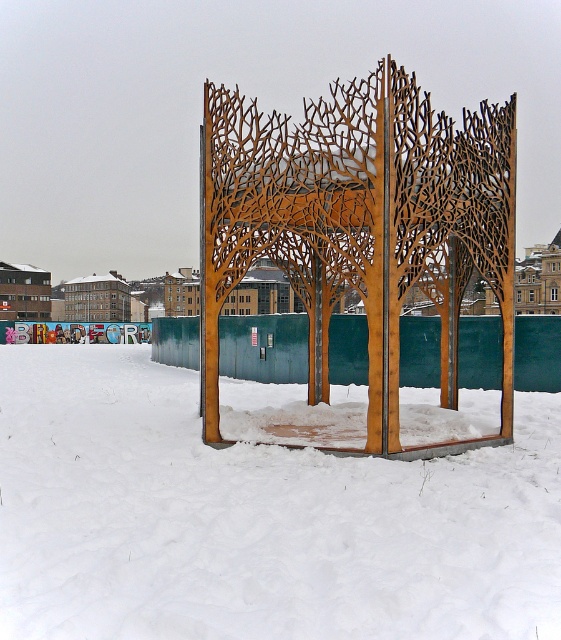
Question: Does white powdery snow at lower center have a smaller size compared to wooden lattice structure at center?

Choices:
 (A) yes
 (B) no

Answer: (A)

Question: Can you confirm if white powdery snow at lower center is thinner than wooden lattice structure at center?

Choices:
 (A) yes
 (B) no

Answer: (B)

Question: Among these points, which one is nearest to the camera?

Choices:
 (A) (229, 600)
 (B) (300, 262)

Answer: (A)

Question: Among these objects, which one is farthest from the camera?

Choices:
 (A) wooden lattice structure at center
 (B) white powdery snow at lower center

Answer: (A)

Question: Can you confirm if white powdery snow at lower center is positioned to the left of wooden lattice structure at center?

Choices:
 (A) yes
 (B) no

Answer: (A)